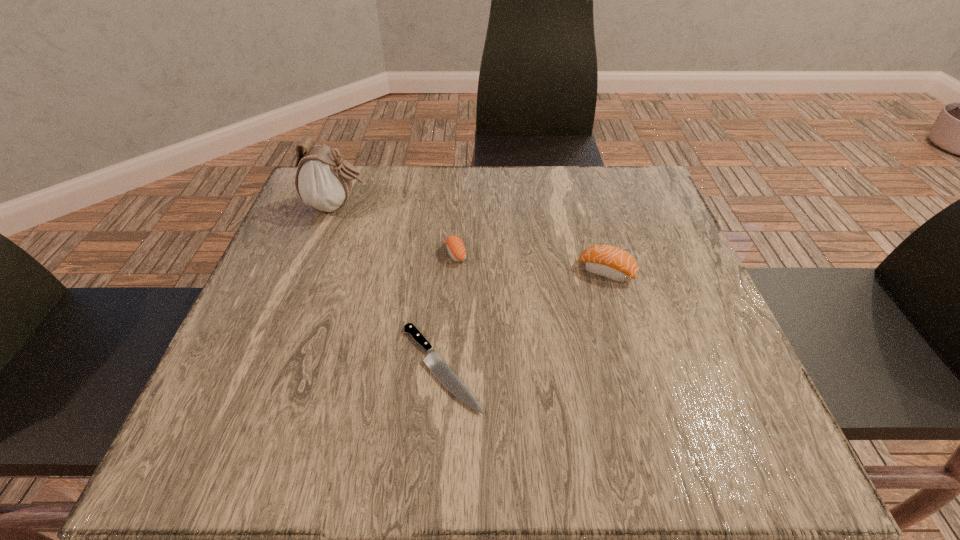
This screenshot has height=540, width=960. I want to click on free location located 0.140m on the right of the left sushi, so click(x=530, y=254).

In order to click on vacant space located on the right of the shortest object in this screenshot , I will do `click(622, 368)`.

Locate an element on the screen. object that is at the far edge is located at coordinates (323, 180).

Find the location of `object that is at the near edge`. object that is at the near edge is located at coordinates (432, 360).

The image size is (960, 540). In order to click on object at the left edge in this screenshot , I will do `click(323, 180)`.

Where is `object located at the right edge`? The height and width of the screenshot is (540, 960). object located at the right edge is located at coordinates (607, 261).

You are a GUI agent. You are given a task and a screenshot of the screen. Output one action in this format:
    pyautogui.click(x=<x>, y=<y>)
    Task: Click on the object located in the far left corner section of the desktop
    The height and width of the screenshot is (540, 960).
    Given the screenshot: What is the action you would take?
    pyautogui.click(x=323, y=180)

Where is `free space at the far edge of the desktop`? This screenshot has width=960, height=540. free space at the far edge of the desktop is located at coordinates (540, 217).

Identify the location of vacant space at the near edge. (504, 420).

What are the coordinates of `blank space at the left edge of the desktop` in the screenshot? It's located at (299, 256).